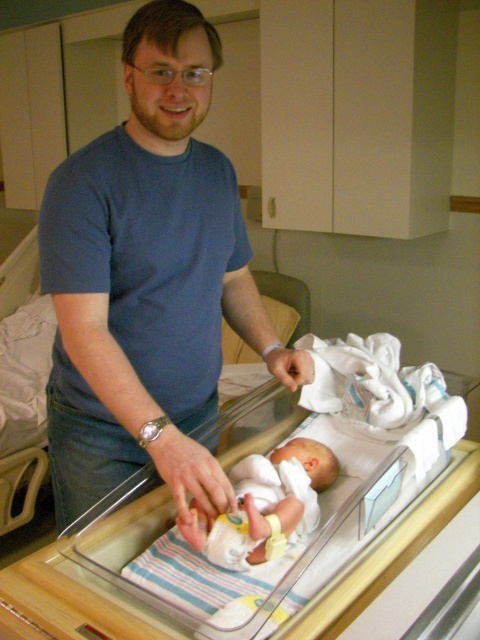
Between point (95, 458) and point (392, 467), which one is positioned behind?

The point (95, 458) is more distant.

Who is shorter, blue cotton shirt at upper left or white fabric infant bed at center?

white fabric infant bed at center is shorter.

Is point (81, 456) closer to viewer compared to point (266, 483)?

No, (81, 456) is behind (266, 483).

What are the coordinates of `blue cotton shirt at upper left` in the screenshot? It's located at (148, 282).

Is white fabric infant bed at center taller than white soft newborn at center?

Correct, white fabric infant bed at center is much taller as white soft newborn at center.

Which is more to the left, white fabric infant bed at center or white soft newborn at center?

white soft newborn at center

Locate an element on the screen. white fabric infant bed at center is located at coordinates (278, 497).

Can you confirm if blue cotton shirt at upper left is positioned above white soft newborn at center?

Yes, blue cotton shirt at upper left is above white soft newborn at center.

Can you confirm if blue cotton shirt at upper left is positioned to the left of white soft newborn at center?

Indeed, blue cotton shirt at upper left is positioned on the left side of white soft newborn at center.

Image resolution: width=480 pixels, height=640 pixels. What do you see at coordinates (148, 282) in the screenshot?
I see `blue cotton shirt at upper left` at bounding box center [148, 282].

Where is `blue cotton shirt at upper left`? blue cotton shirt at upper left is located at coordinates (148, 282).